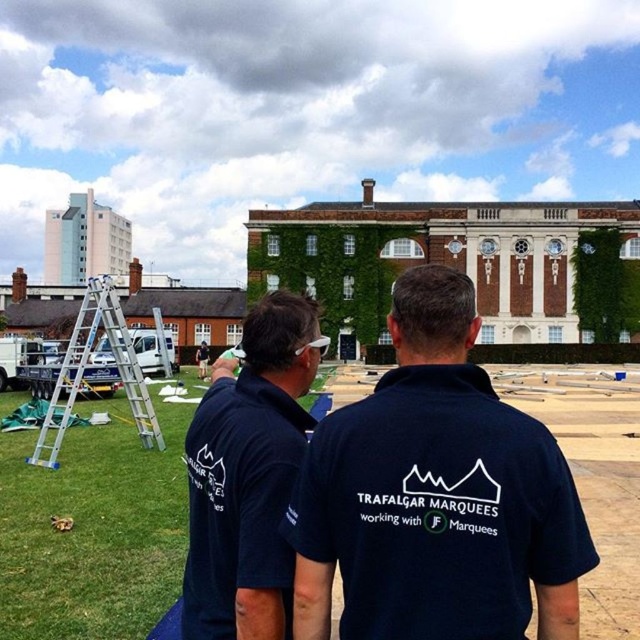
Question: Is navy blue shirt at center wider than dark blue polo shirt at center?

Choices:
 (A) no
 (B) yes

Answer: (B)

Question: Estimate the real-world distances between objects in this image. Which object is closer to the dark blue polo shirt at center?

Choices:
 (A) silver/aluminum ladder at left
 (B) navy blue shirt at center

Answer: (B)

Question: Considering the relative positions of navy blue shirt at center and dark blue polo shirt at center in the image provided, where is navy blue shirt at center located with respect to dark blue polo shirt at center?

Choices:
 (A) left
 (B) right

Answer: (B)

Question: Among these objects, which one is nearest to the camera?

Choices:
 (A) silver/aluminum ladder at left
 (B) dark blue polo shirt at center
 (C) navy blue shirt at center

Answer: (C)

Question: Does navy blue shirt at center have a larger size compared to dark blue polo shirt at center?

Choices:
 (A) yes
 (B) no

Answer: (A)

Question: Based on their relative distances, which object is nearer to the silver/aluminum ladder at left?

Choices:
 (A) navy blue shirt at center
 (B) dark blue polo shirt at center

Answer: (B)